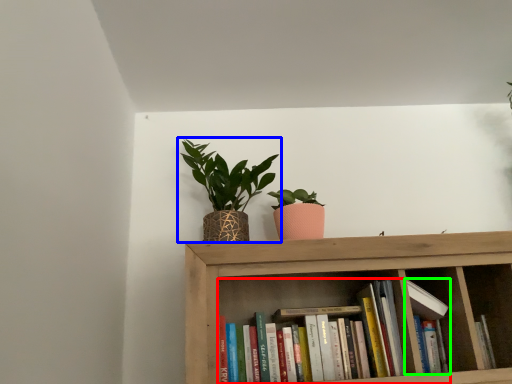
Question: Based on their relative distances, which object is nearer to book (highlighted by a red box)? Choose from houseplant (highlighted by a blue box) and book (highlighted by a green box).

Choices:
 (A) houseplant
 (B) book

Answer: (B)